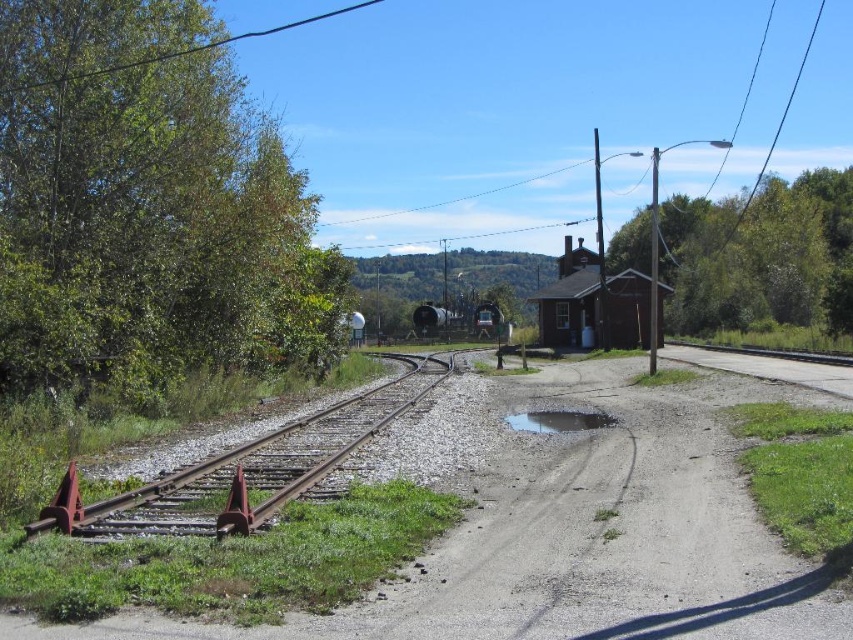
You are standing on the railway tracks and looking towards the direction of the tracks. Which green leafy tree do you see first, the green leafy tree at left or the green leafy tree at upper center?

The green leafy tree at left is to the left of green leafy tree at upper center, so when looking in the direction of the tracks, you would see the green leafy tree at left first before the green leafy tree at upper center.